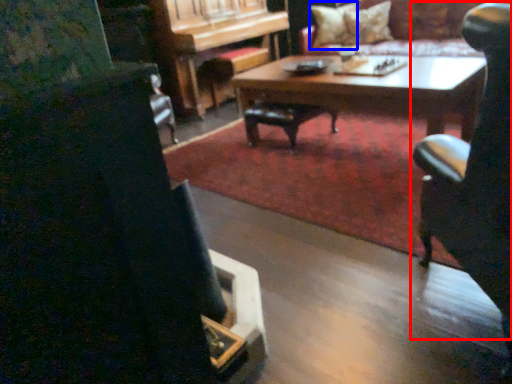
Question: Which point is further to the camera, chair (highlighted by a red box) or pillow (highlighted by a blue box)?

Choices:
 (A) chair
 (B) pillow

Answer: (B)